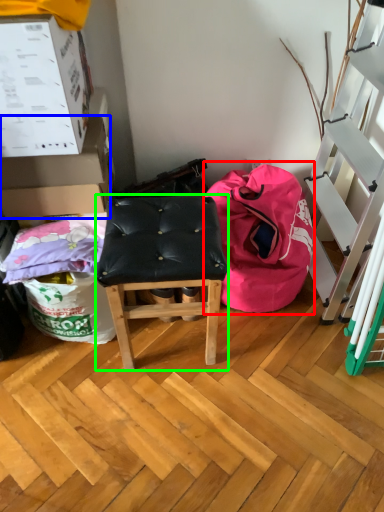
Question: Considering the real-world distances, which object is closest to bean bag chair (highlighted by a red box)? box (highlighted by a blue box) or stool (highlighted by a green box).

Choices:
 (A) box
 (B) stool

Answer: (B)